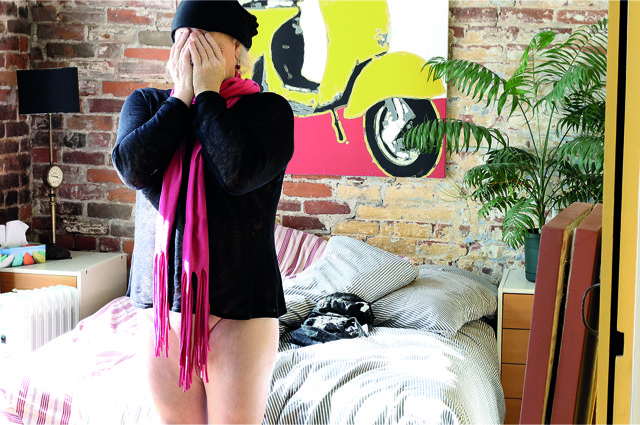
Where is `top nightstand drawer`? This screenshot has height=425, width=640. top nightstand drawer is located at coordinates (514, 313), (40, 279).